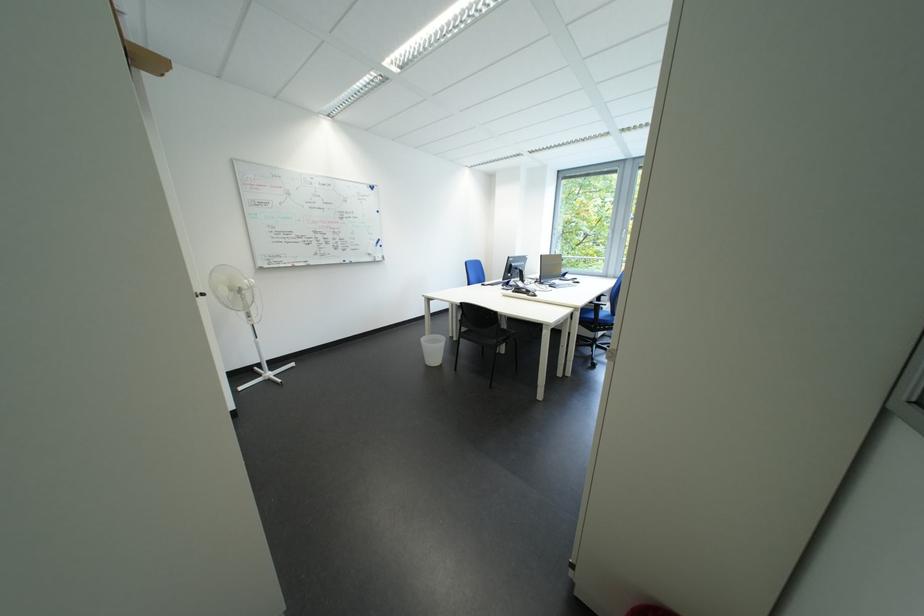
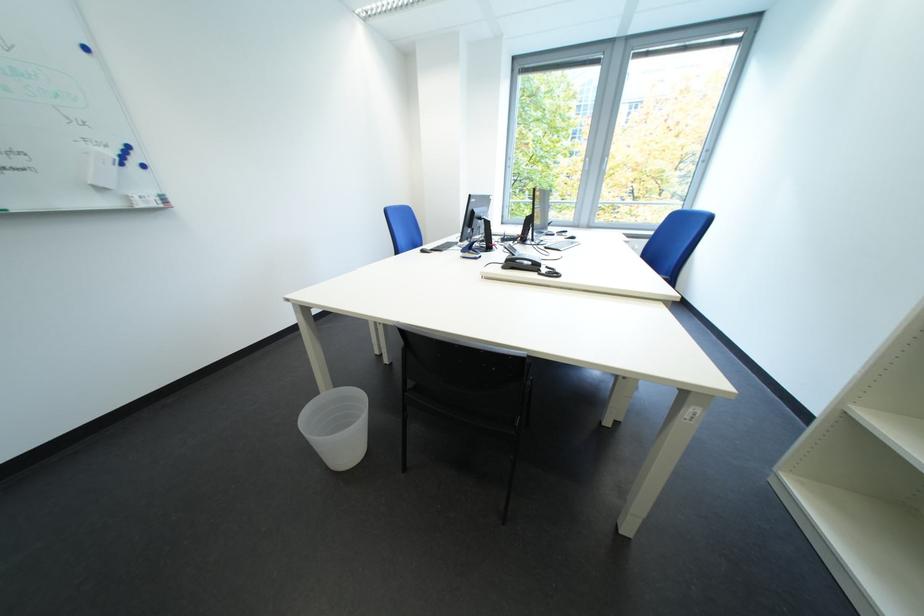
In the second image, find the point that corresponds to (530,293) in the first image.

(524, 265)